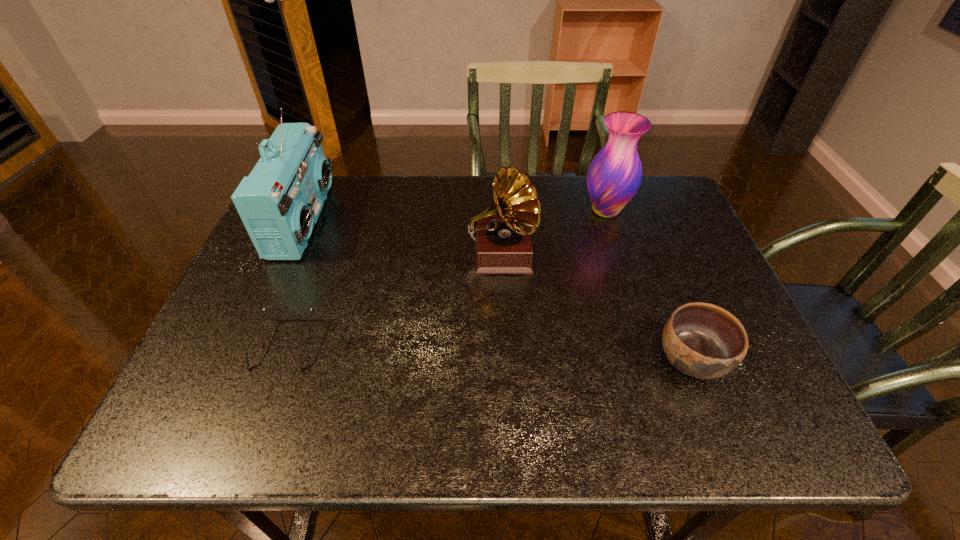
Where is `vacant area between the vase and the bowl`? vacant area between the vase and the bowl is located at coordinates (648, 285).

Where is `free space between the third object from right to left and the shortest object`? free space between the third object from right to left and the shortest object is located at coordinates (394, 300).

Identify which object is the fourth nearest to the phonograph record. Please provide its 2D coordinates. Your answer should be formatted as a tuple, i.e. [(x, y)], where the tuple contains the x and y coordinates of a point satisfying the conditions above.

[(280, 201)]

Locate which object is the fourth closest to the shortest object. Please provide its 2D coordinates. Your answer should be formatted as a tuple, i.e. [(x, y)], where the tuple contains the x and y coordinates of a point satisfying the conditions above.

[(614, 175)]

Identify the location of vacant area that satisfies the following two spatial constraints: 1. on the front-facing side of the bowl; 2. on the left side of the radio receiver. Image resolution: width=960 pixels, height=540 pixels. (243, 360).

Image resolution: width=960 pixels, height=540 pixels. Identify the location of free spot that satisfies the following two spatial constraints: 1. with the lenses facing outward on the fourth tallest object; 2. on the right side of the spectacles. (279, 360).

Where is `free region that satisfies the following two spatial constraints: 1. on the front-facing side of the radio receiver; 2. on the back side of the second shortest object`? This screenshot has height=540, width=960. free region that satisfies the following two spatial constraints: 1. on the front-facing side of the radio receiver; 2. on the back side of the second shortest object is located at coordinates (243, 360).